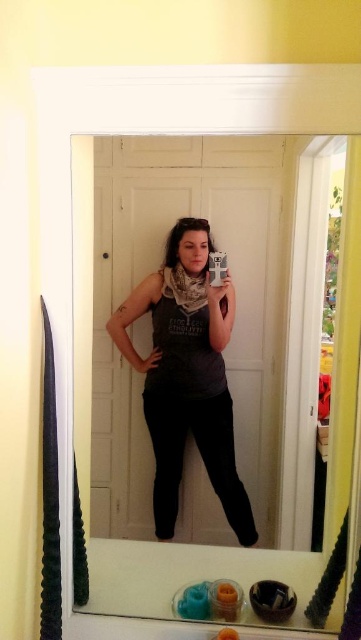
Between clear glass mirror at center and matte gray tank top at center, which one appears on the left side from the viewer's perspective?

From the viewer's perspective, matte gray tank top at center appears more on the left side.

Is clear glass mirror at center wider than matte gray tank top at center?

Yes.

Who is more distant from viewer, (83, 209) or (131, 300)?

The point (131, 300) is behind.

I want to click on clear glass mirror at center, so click(225, 369).